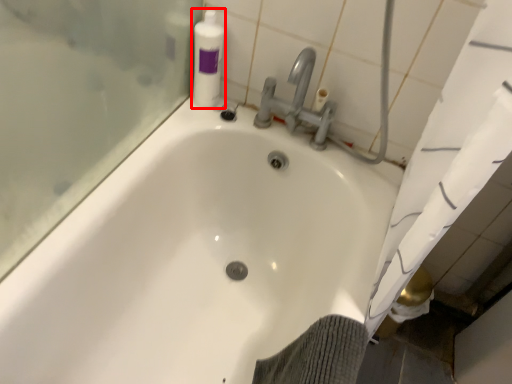
Question: From the image's perspective, where is cleaning product (annotated by the red box) located relative to bathtub?

Choices:
 (A) above
 (B) below

Answer: (A)